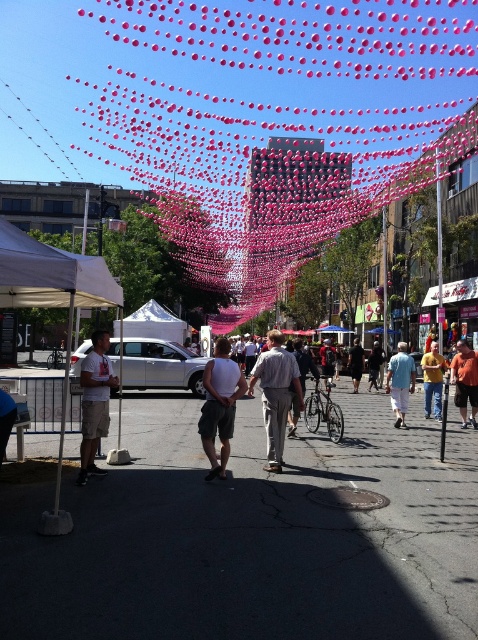
Which is behind, point (79, 381) or point (401, 397)?

Point (401, 397)

Which is in front, point (99, 396) or point (391, 356)?

Positioned in front is point (99, 396).

I want to click on white cotton t-shirt at left, so click(95, 403).

Can you confirm if white cotton t-shirt at left is positioned above yellow matte shirt at center?

Yes, white cotton t-shirt at left is above yellow matte shirt at center.

Describe the element at coordinates (95, 403) in the screenshot. I see `white cotton t-shirt at left` at that location.

The image size is (478, 640). What are the coordinates of `white cotton t-shirt at left` in the screenshot? It's located at (95, 403).

Find the location of a particular element. white cotton t-shirt at left is located at coordinates (95, 403).

Is light gray cotton shirt at center shorter than white cotton t-shirt at left?

Incorrect, light gray cotton shirt at center's height does not fall short of white cotton t-shirt at left's.

Is point (272, 406) less distant than point (107, 371)?

No, it is behind (107, 371).

The height and width of the screenshot is (640, 478). Find the location of `light gray cotton shirt at center`. light gray cotton shirt at center is located at coordinates (275, 394).